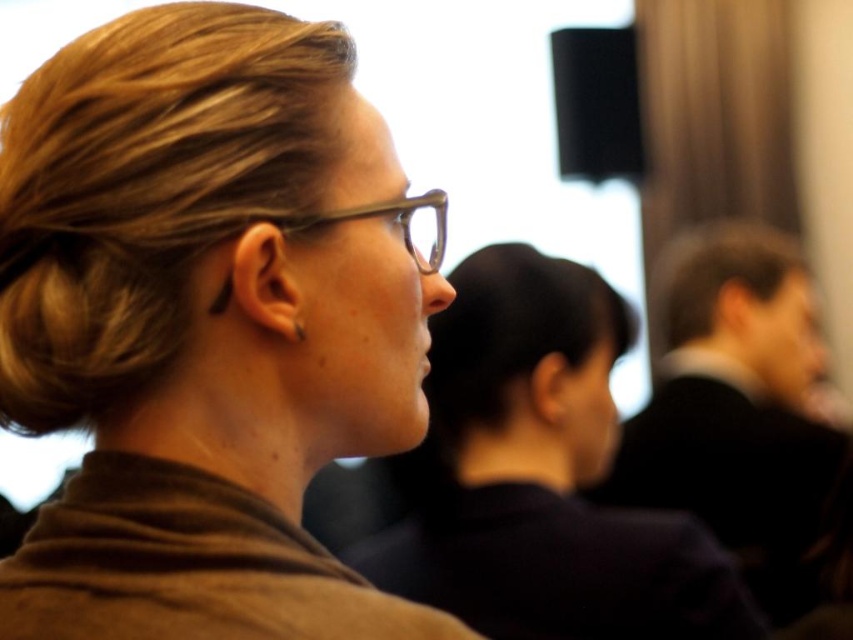
Question: Which point appears farthest from the camera in this image?

Choices:
 (A) pos(445,196)
 (B) pos(381,248)

Answer: (A)

Question: Which is nearer to the brown matte scarf at upper left?

Choices:
 (A) transparent plastic glasses at center
 (B) clear plastic glasses at center

Answer: (A)

Question: Which of the following is the closest to the observer?

Choices:
 (A) (398, 208)
 (B) (409, 237)

Answer: (A)

Question: Is transparent plastic glasses at center behind clear plastic glasses at center?

Choices:
 (A) no
 (B) yes

Answer: (A)

Question: Can you confirm if brown matte scarf at upper left is smaller than clear plastic glasses at center?

Choices:
 (A) no
 (B) yes

Answer: (A)

Question: Is brown matte scarf at upper left further to camera compared to clear plastic glasses at center?

Choices:
 (A) yes
 (B) no

Answer: (B)